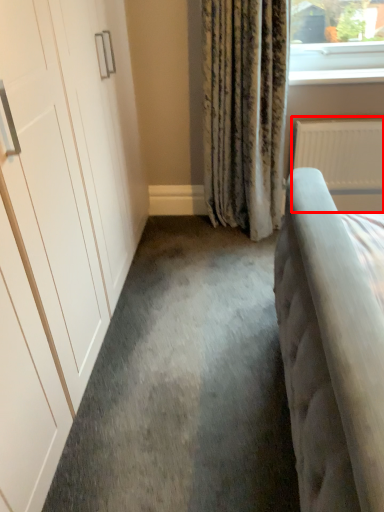
Question: Where is radiator (annotated by the red box) located in relation to window sill in the image?

Choices:
 (A) left
 (B) right

Answer: (B)